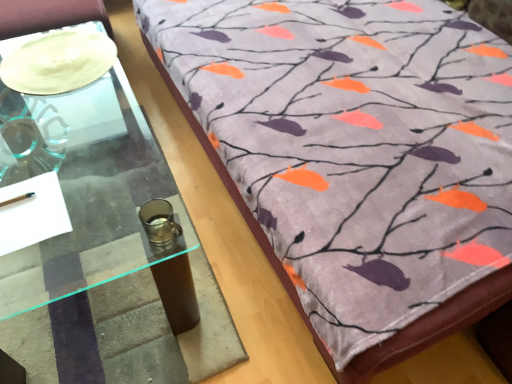
This screenshot has height=384, width=512. Find the location of `free point above white matte plate at upper left (from a real-world perspective)`. free point above white matte plate at upper left (from a real-world perspective) is located at coordinates (x=44, y=60).